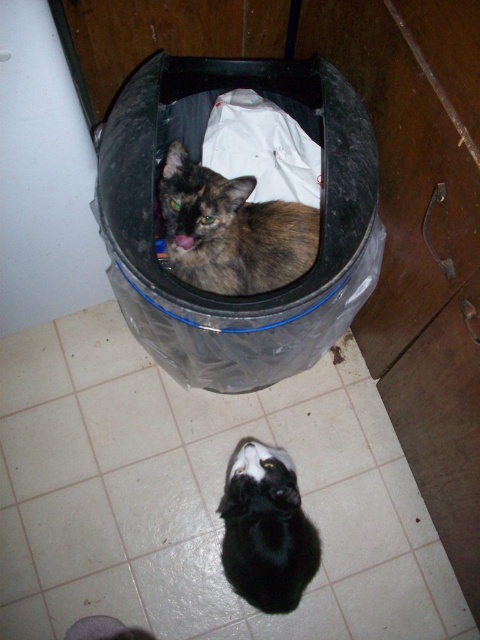
Question: Does brown fur cat at center have a greater width compared to black glossy cat at lower center?

Choices:
 (A) no
 (B) yes

Answer: (B)

Question: Can you confirm if black glossy cat at lower center is bigger than white fabric at center?

Choices:
 (A) yes
 (B) no

Answer: (A)

Question: Based on their relative distances, which object is nearer to the brown fur cat at center?

Choices:
 (A) black glossy cat at lower center
 (B) white fabric at center

Answer: (B)

Question: Estimate the real-world distances between objects in this image. Which object is closer to the white fabric at center?

Choices:
 (A) black glossy cat at lower center
 (B) brown fur cat at center

Answer: (B)

Question: Is brown fur cat at center further to camera compared to white fabric at center?

Choices:
 (A) no
 (B) yes

Answer: (A)

Question: Which of these objects is positioned farthest from the brown fur cat at center?

Choices:
 (A) black glossy cat at lower center
 (B) white fabric at center

Answer: (A)